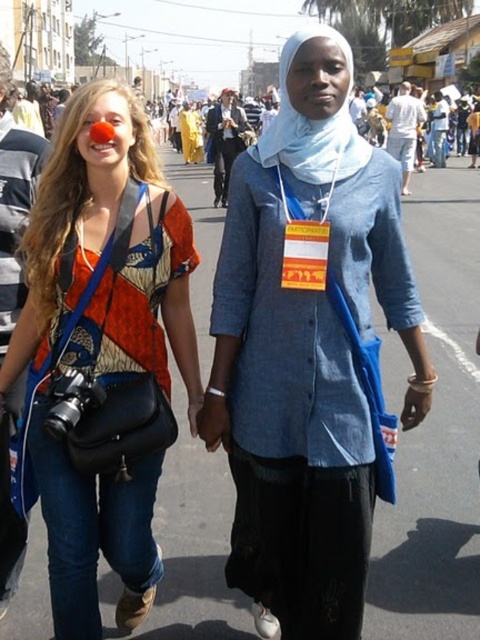
Question: Considering the real-world distances, which object is closest to the blue denim shirt at center?

Choices:
 (A) matte black camera at center
 (B) white fabric scarf at center

Answer: (A)

Question: Can you confirm if blue denim shirt at center is thinner than white fabric scarf at center?

Choices:
 (A) no
 (B) yes

Answer: (A)

Question: Can you confirm if matte black camera at center is smaller than white fabric scarf at center?

Choices:
 (A) yes
 (B) no

Answer: (A)

Question: Can you confirm if blue denim shirt at center is positioned to the right of matte black camera at center?

Choices:
 (A) no
 (B) yes

Answer: (B)

Question: Based on their relative distances, which object is farther from the white fabric scarf at center?

Choices:
 (A) blue denim shirt at center
 (B) matte black camera at center

Answer: (B)

Question: Which of the following is the closest to the observer?

Choices:
 (A) (146, 460)
 (B) (347, 58)
 (C) (289, 273)

Answer: (C)